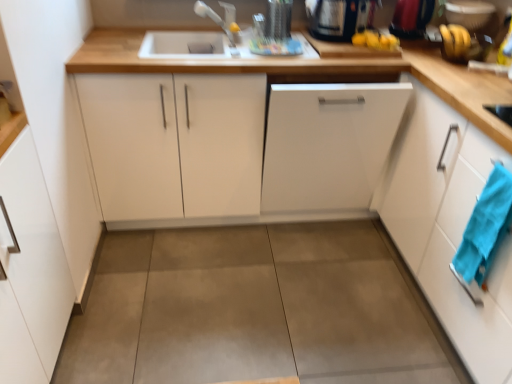
Question: Is black glossy kettle at upper right, which ranks as the 1th appliance in left-to-right order, shorter than white glossy cabinet at right, arranged as the fourth cabinetry when viewed from the left?

Choices:
 (A) yes
 (B) no

Answer: (A)

Question: Does black glossy kettle at upper right, which ranks as the 1th appliance in left-to-right order, have a greater height compared to white glossy cabinet at right, arranged as the fourth cabinetry when viewed from the left?

Choices:
 (A) no
 (B) yes

Answer: (A)

Question: Is black glossy kettle at upper right, which appears as the 3th appliance when viewed from the right, positioned in front of white glossy cabinet at right, arranged as the fourth cabinetry when viewed from the left?

Choices:
 (A) no
 (B) yes

Answer: (A)

Question: Does black glossy kettle at upper right, which appears as the 3th appliance when viewed from the right, lie behind white glossy cabinet at right, which is the 1th cabinetry from right to left?

Choices:
 (A) yes
 (B) no

Answer: (A)

Question: Does black glossy kettle at upper right, which appears as the 3th appliance when viewed from the right, appear on the right side of white glossy cabinet at right, which is the 1th cabinetry from right to left?

Choices:
 (A) yes
 (B) no

Answer: (B)

Question: Is black glossy kettle at upper right, which appears as the 3th appliance when viewed from the right, not inside white glossy cabinet at right, arranged as the fourth cabinetry when viewed from the left?

Choices:
 (A) no
 (B) yes

Answer: (B)

Question: Can you confirm if metallic silver kettle at upper right, arranged as the second appliance when viewed from the right, is bigger than blue fabric hand towel at right?

Choices:
 (A) yes
 (B) no

Answer: (A)

Question: Is metallic silver kettle at upper right, the 2th appliance positioned from the left, not close to blue fabric hand towel at right?

Choices:
 (A) no
 (B) yes

Answer: (B)

Question: From the image's perspective, is metallic silver kettle at upper right, the 2th appliance positioned from the left, located above blue fabric hand towel at right?

Choices:
 (A) yes
 (B) no

Answer: (A)

Question: From a real-world perspective, is metallic silver kettle at upper right, the 2th appliance positioned from the left, below blue fabric hand towel at right?

Choices:
 (A) no
 (B) yes

Answer: (A)

Question: Is metallic silver kettle at upper right, the 2th appliance positioned from the left, outside blue fabric hand towel at right?

Choices:
 (A) yes
 (B) no

Answer: (A)

Question: Is metallic silver kettle at upper right, the 2th appliance positioned from the left, beside blue fabric hand towel at right?

Choices:
 (A) no
 (B) yes

Answer: (A)

Question: Considering the relative positions of white matte dishwasher at center, positioned as the 2th cabinetry in right-to-left order, and black glossy kettle at upper right, which appears as the 3th appliance when viewed from the right, in the image provided, is white matte dishwasher at center, positioned as the 2th cabinetry in right-to-left order, behind black glossy kettle at upper right, which appears as the 3th appliance when viewed from the right,?

Choices:
 (A) no
 (B) yes

Answer: (A)